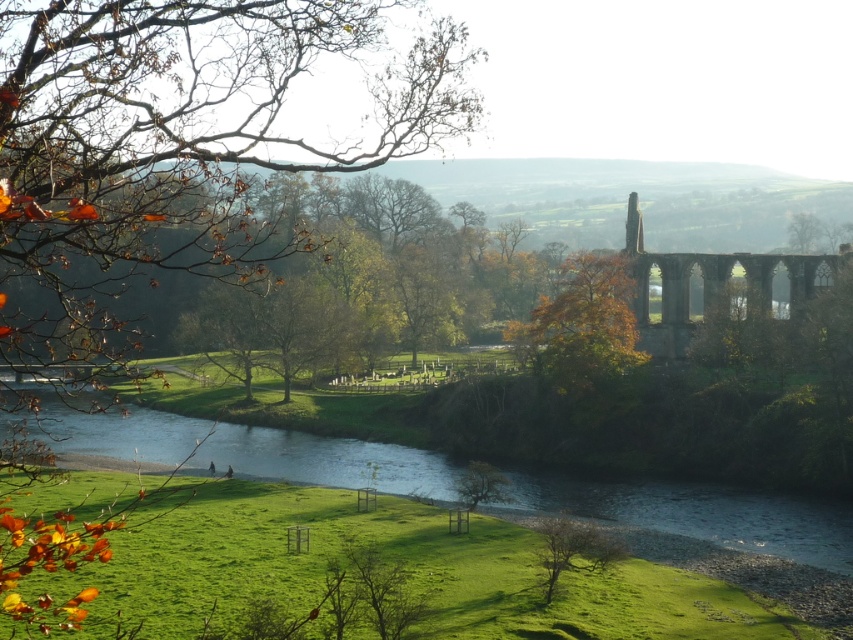
Is point (664, 584) less distant than point (592, 540)?

That is False.

Between green grass at lower center and bare branches at lower center, which one has more height?

Standing taller between the two is green grass at lower center.

Which is behind, point (276, 528) or point (547, 552)?

The point (276, 528) is more distant.

Locate an element on the screen. green grass at lower center is located at coordinates (402, 570).

Does brown leafy branch at upper left appear under green grass at lower center?

No.

Who is more distant from viewer, (39, 627) or (262, 484)?

Positioned behind is point (262, 484).

What do you see at coordinates (175, 148) in the screenshot? The height and width of the screenshot is (640, 853). I see `brown leafy branch at upper left` at bounding box center [175, 148].

At what (x,y) coordinates should I click in order to perform the action: click on brown leafy branch at upper left. Please return your answer as a coordinate pair (x, y). This screenshot has width=853, height=640. Looking at the image, I should click on (175, 148).

Can you confirm if green grass at lower center is shorter than stone arches at right?

Yes, green grass at lower center is shorter than stone arches at right.

Does green grass at lower center appear under stone arches at right?

Yes.

Who is more distant from viewer, (560, 636) or (689, 268)?

The point (689, 268) is behind.

This screenshot has height=640, width=853. I want to click on green grass at lower center, so click(x=402, y=570).